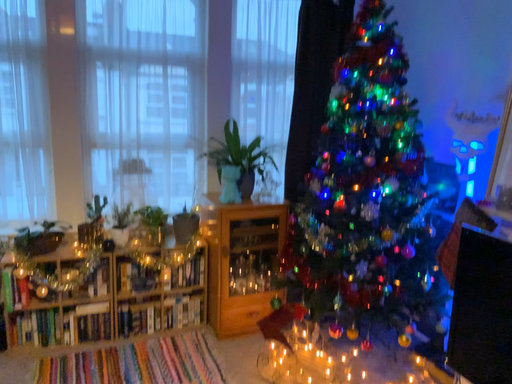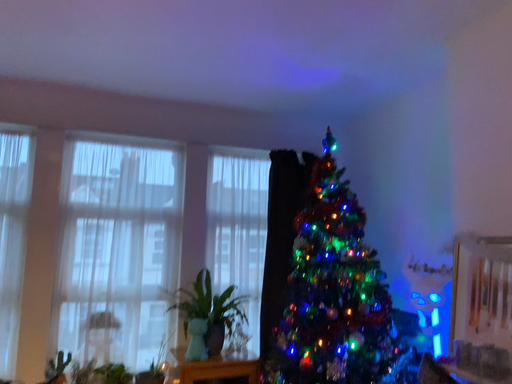
Question: How did the camera likely rotate when shooting the video?

Choices:
 (A) rotated downward
 (B) rotated upward

Answer: (B)